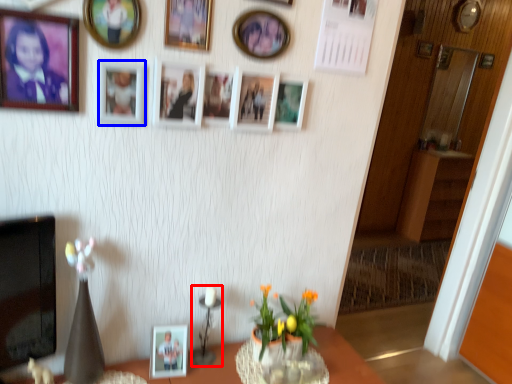
Question: Which object appears closest to the camera in this image, candle holder (highlighted by a red box) or picture frame (highlighted by a blue box)?

Choices:
 (A) candle holder
 (B) picture frame

Answer: (B)